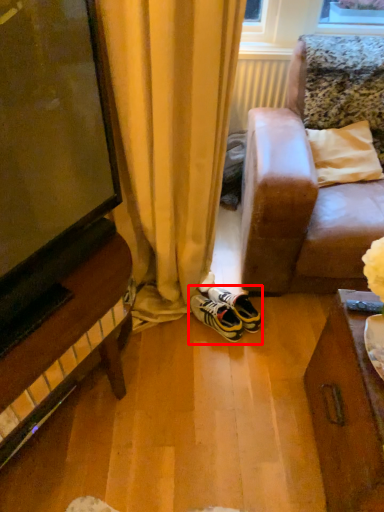
Question: From the image, what is the correct spatial relationship of footwear (annotated by the red box) in relation to radiator?

Choices:
 (A) right
 (B) left

Answer: (B)